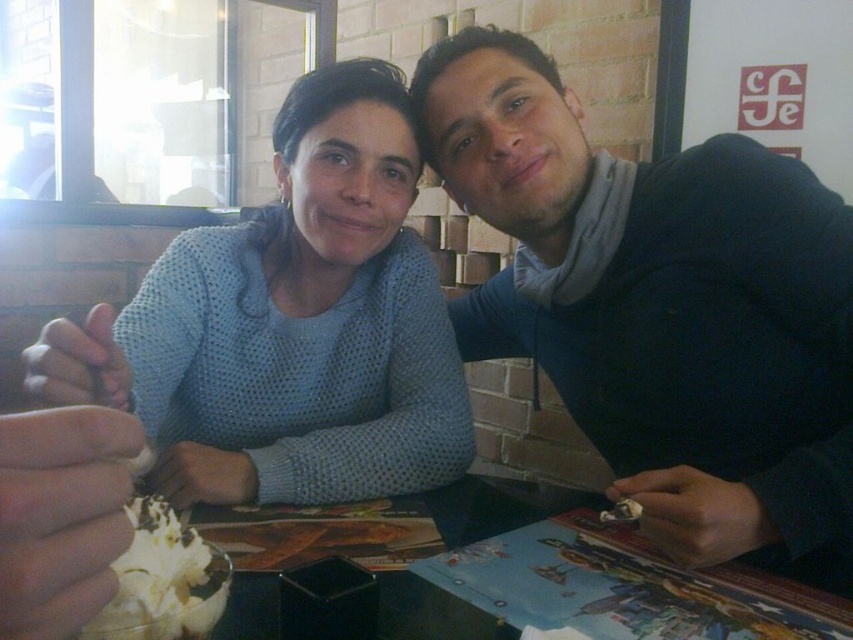
Question: Does light blue knitted sweater at upper left have a larger size compared to whipped cream at lower left?

Choices:
 (A) no
 (B) yes

Answer: (B)

Question: Does light blue knitted sweater at upper left appear on the left side of whipped cream at lower left?

Choices:
 (A) no
 (B) yes

Answer: (B)

Question: Which point appears closest to the camera in this image?

Choices:
 (A) (165, 570)
 (B) (288, 324)

Answer: (A)

Question: From the image, what is the correct spatial relationship of light blue knitted sweater at upper left in relation to whipped cream at lower left?

Choices:
 (A) below
 (B) above

Answer: (B)